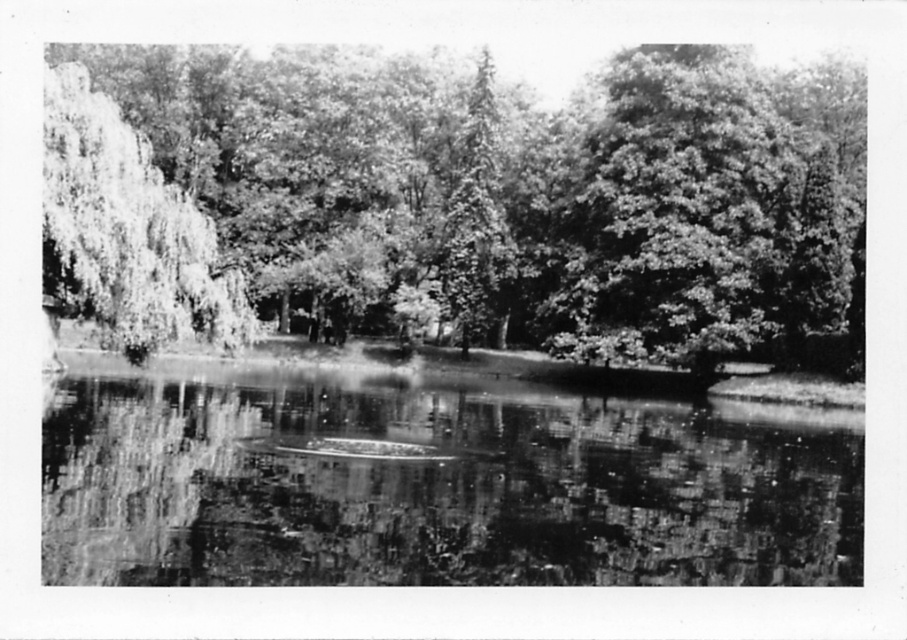
Between smooth green tree at upper left and smooth reflective water at center, which one is positioned higher?

smooth green tree at upper left is higher up.

Does smooth green tree at upper left appear under smooth reflective water at center?

No, smooth green tree at upper left is not below smooth reflective water at center.

Does point (593, 324) come farther from viewer compared to point (826, 444)?

Yes.

Where is `smooth green tree at upper left`? smooth green tree at upper left is located at coordinates (527, 189).

Does smooth reflective water at center have a smaller size compared to grayscale leafy tree at left?

Yes.

The width and height of the screenshot is (907, 640). Describe the element at coordinates (435, 486) in the screenshot. I see `smooth reflective water at center` at that location.

Which is in front, point (212, 444) or point (196, 205)?

Positioned in front is point (212, 444).

Find the location of `smooth reflective water at center`. smooth reflective water at center is located at coordinates (435, 486).

Does smooth green tree at upper left come in front of grayscale leafy tree at left?

No.

What do you see at coordinates (527, 189) in the screenshot? This screenshot has height=640, width=907. I see `smooth green tree at upper left` at bounding box center [527, 189].

Locate an element on the screen. Image resolution: width=907 pixels, height=640 pixels. smooth green tree at upper left is located at coordinates (527, 189).